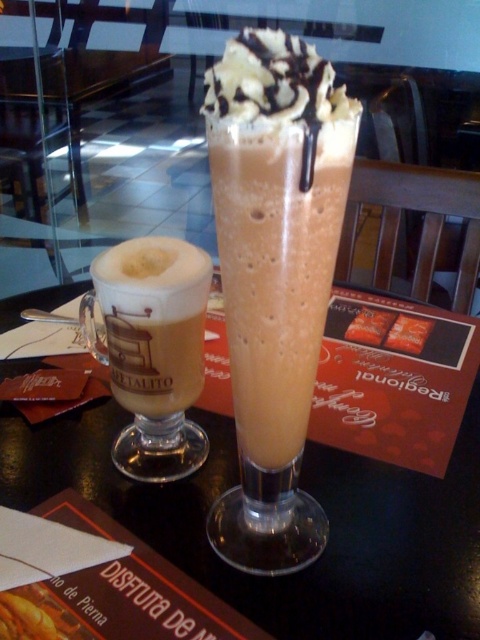
Which is in front, point (467, 618) or point (136, 280)?

Point (467, 618) is in front.

Does translucent glass table at center appear over matte glass mug at left?

Actually, translucent glass table at center is below matte glass mug at left.

Locate an element on the screen. This screenshot has height=640, width=480. translucent glass table at center is located at coordinates (310, 493).

Locate an element on the screen. translucent glass table at center is located at coordinates (310, 493).

Is translucent glass table at center below whipped cream topped chocolate milkshake at center?

Yes.

Is translucent glass table at center smaller than whipped cream topped chocolate milkshake at center?

Incorrect, translucent glass table at center is not smaller in size than whipped cream topped chocolate milkshake at center.

The width and height of the screenshot is (480, 640). I want to click on translucent glass table at center, so click(x=310, y=493).

Can you confirm if whipped cream topped chocolate milkshake at center is shorter than matte glass mug at left?

No, whipped cream topped chocolate milkshake at center is not shorter than matte glass mug at left.

Is whipped cream topped chocolate milkshake at center below matte glass mug at left?

Correct, whipped cream topped chocolate milkshake at center is located below matte glass mug at left.

This screenshot has height=640, width=480. What do you see at coordinates (275, 276) in the screenshot?
I see `whipped cream topped chocolate milkshake at center` at bounding box center [275, 276].

In order to click on whipped cream topped chocolate milkshake at center in this screenshot , I will do `click(275, 276)`.